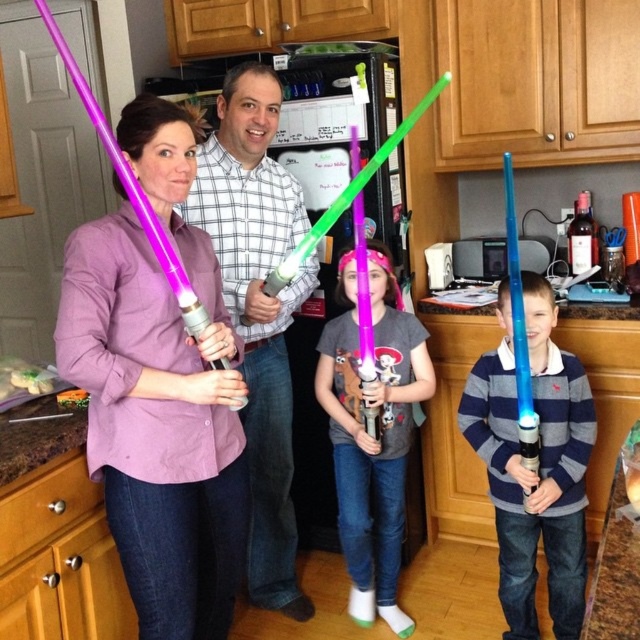
Question: Which object appears closest to the camera in this image?

Choices:
 (A) blue translucent light saber at center
 (B) matte purple lightsaber at center
 (C) matte pink shirt at center

Answer: (C)

Question: Which object appears farthest from the camera in this image?

Choices:
 (A) matte purple lightsaber at center
 (B) matte pink shirt at center
 (C) blue translucent light saber at center
 (D) matte green plastic lightsaber at center

Answer: (A)

Question: Where is blue translucent light saber at center located in relation to matte purple lightsaber at center in the image?

Choices:
 (A) below
 (B) above

Answer: (A)

Question: Which of the following is the closest to the observer?

Choices:
 (A) matte purple lightsaber at center
 (B) matte pink shirt at center
 (C) blue translucent light saber at center
 (D) matte green plastic lightsaber at center

Answer: (B)

Question: From the image, what is the correct spatial relationship of matte green plastic lightsaber at center in relation to matte purple lightsaber at center?

Choices:
 (A) below
 (B) above

Answer: (B)

Question: Is matte pink shirt at center to the left of matte purple lightsaber at center from the viewer's perspective?

Choices:
 (A) yes
 (B) no

Answer: (A)